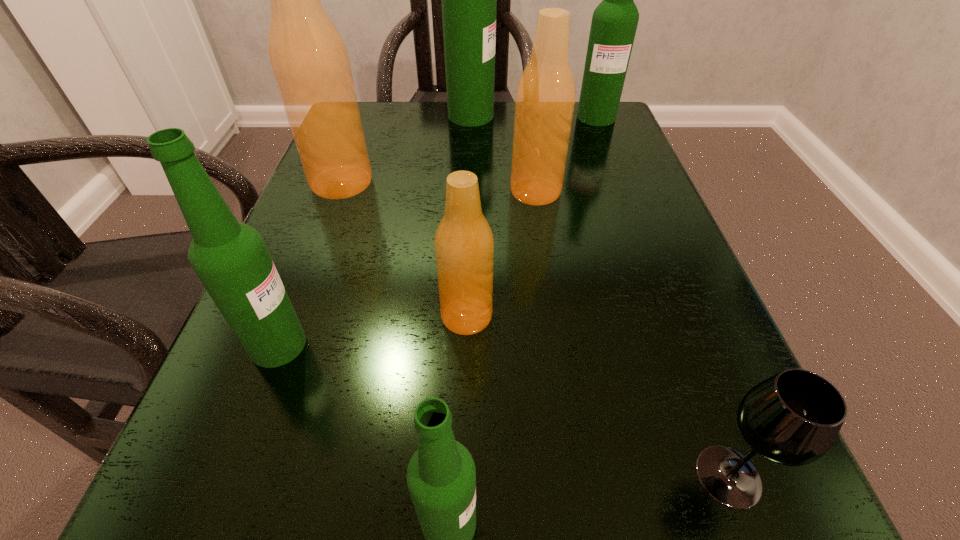
At what (x,y) coordinates should I click in order to perform the action: click on object that is at the near edge. Please return your answer as a coordinate pair (x, y). This screenshot has height=540, width=960. Looking at the image, I should click on (793, 418).

I want to click on beer bottle that is at the right edge, so click(614, 23).

You are a GUI agent. You are given a task and a screenshot of the screen. Output one action in this format:
    pyautogui.click(x=<x>, y=<y>)
    Task: Click on the wineglass positioned at the right edge
    The image size is (960, 540).
    Given the screenshot: What is the action you would take?
    pyautogui.click(x=793, y=418)

At what (x,y) coordinates should I click in order to perform the action: click on object that is at the far right corner. Please return your answer as a coordinate pair (x, y). Looking at the image, I should click on (614, 23).

In order to click on object present at the near right corner in this screenshot , I will do `click(793, 418)`.

The height and width of the screenshot is (540, 960). In the image, there is a desktop. Identify the location of vacant space at the far edge. (462, 134).

This screenshot has height=540, width=960. I want to click on free space at the near edge, so point(525,505).

The width and height of the screenshot is (960, 540). In order to click on free space at the left edge in this screenshot , I will do `click(270, 444)`.

At what (x,y) coordinates should I click in order to perform the action: click on vacant space at the right edge of the desktop. Please return your answer as a coordinate pair (x, y). Image resolution: width=960 pixels, height=540 pixels. Looking at the image, I should click on (649, 224).

This screenshot has height=540, width=960. I want to click on free region at the far left corner of the desktop, so click(392, 141).